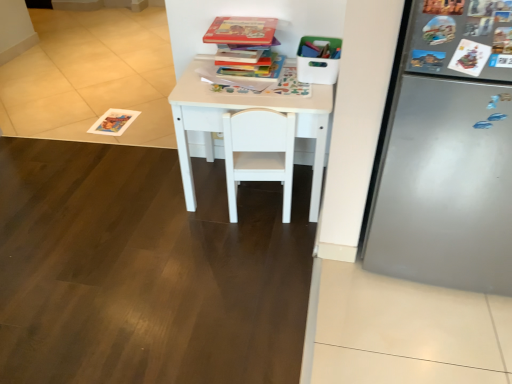
Identify the location of free space on the front side of hardcover book at center, marked as the first book in a bottom-to-top arrangement. The width and height of the screenshot is (512, 384). (253, 97).